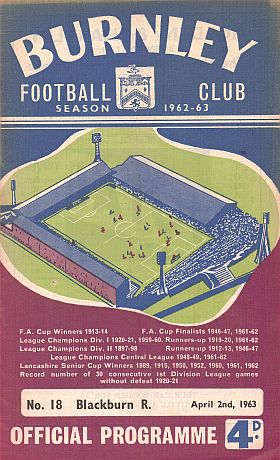
Locate an element on the screen. This screenshot has height=460, width=280. stairs is located at coordinates (219, 275).